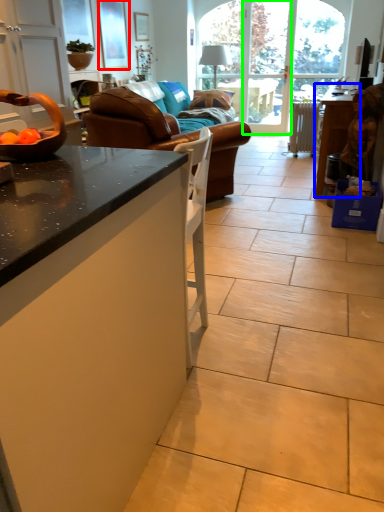
Question: Which object is positioned farthest from picture frame (highlighted by a red box)? Select from table (highlighted by a blue box) and screen door (highlighted by a green box).

Choices:
 (A) table
 (B) screen door

Answer: (A)